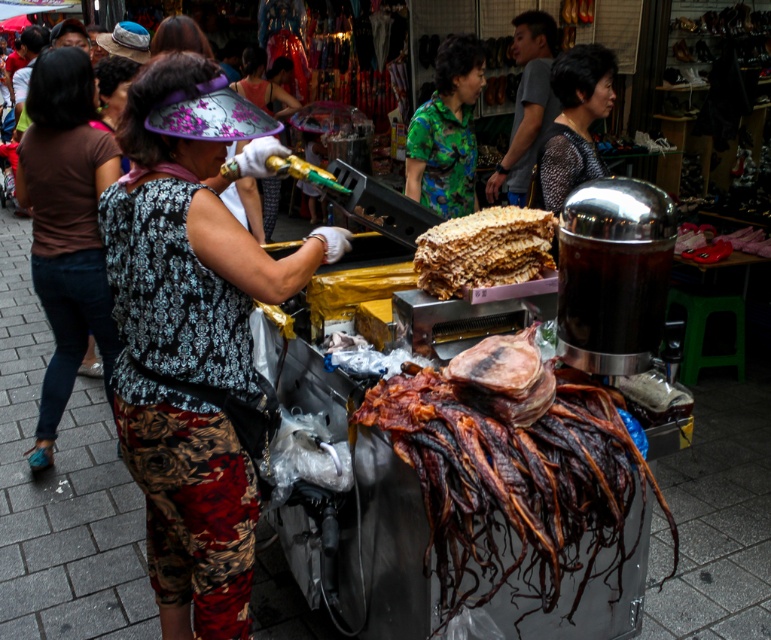
Question: Among these objects, which one is farthest from the camera?

Choices:
 (A) crumbly golden cake at center
 (B) green printed shirt at center

Answer: (B)

Question: Can you confirm if brown leather jerky at center is bigger than black dotted blouse at upper center?

Choices:
 (A) yes
 (B) no

Answer: (A)

Question: Which of these objects is positioned closest to the black dotted blouse at upper center?

Choices:
 (A) patterned fabric headwear at center
 (B) crumbly golden cake at center
 (C) brown leather jerky at center

Answer: (B)

Question: Is patterned fabric headwear at center below crumbly golden cake at center?

Choices:
 (A) no
 (B) yes

Answer: (B)

Question: Can you confirm if brown fabric shirt at left is thinner than crumbly golden cake at center?

Choices:
 (A) yes
 (B) no

Answer: (B)

Question: Which object appears farthest from the camera in this image?

Choices:
 (A) crumbly golden cake at center
 (B) patterned fabric headband at center

Answer: (A)